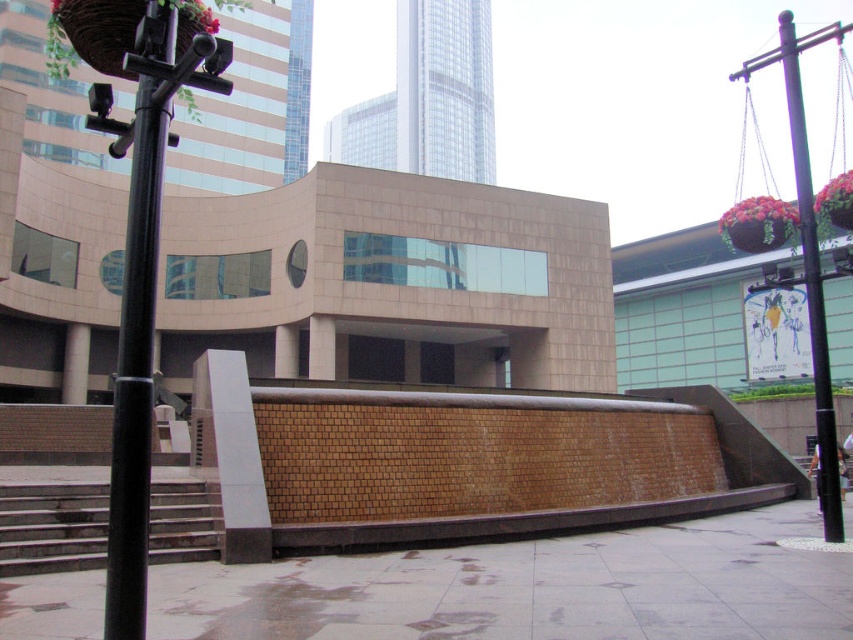
You are a maintenance worker inspecting the plaza. You need to check the black metal pole at left and the black metal pole at right. According to the scene, which pole is positioned lower in the image?

The black metal pole at left is located below the black metal pole at right, so it is positioned lower in the image.

You are a delivery person trying to navigate through the plaza. You need to place a large package on the brown concrete pavement at center. However, there is a black metal pole at right in the way. Based on their positions, can you move the package to the pavement without moving the pole?

The brown concrete pavement at center is positioned on the left side of black metal pole at right. Therefore, you can move the package around the left side of the black metal pole at right to reach the pavement without moving the pole.